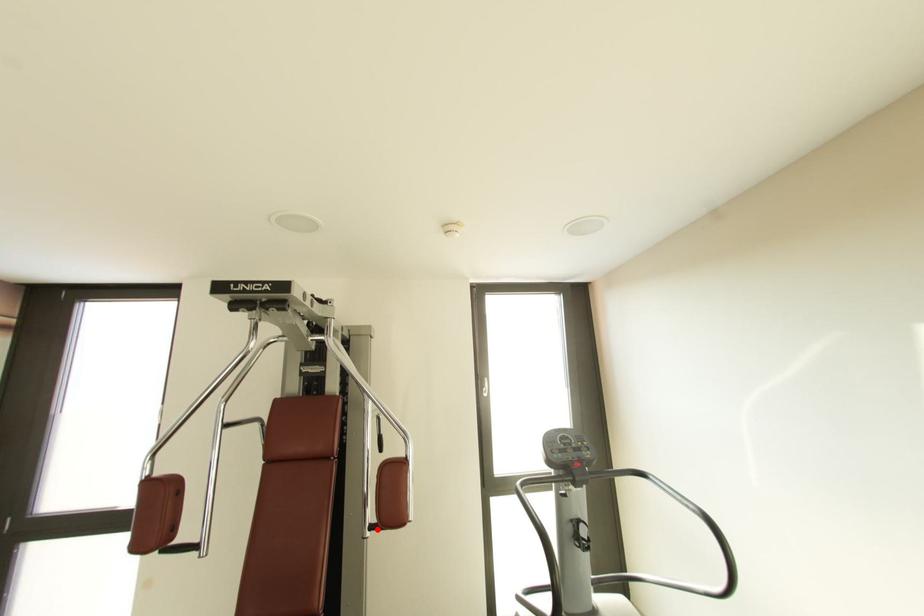
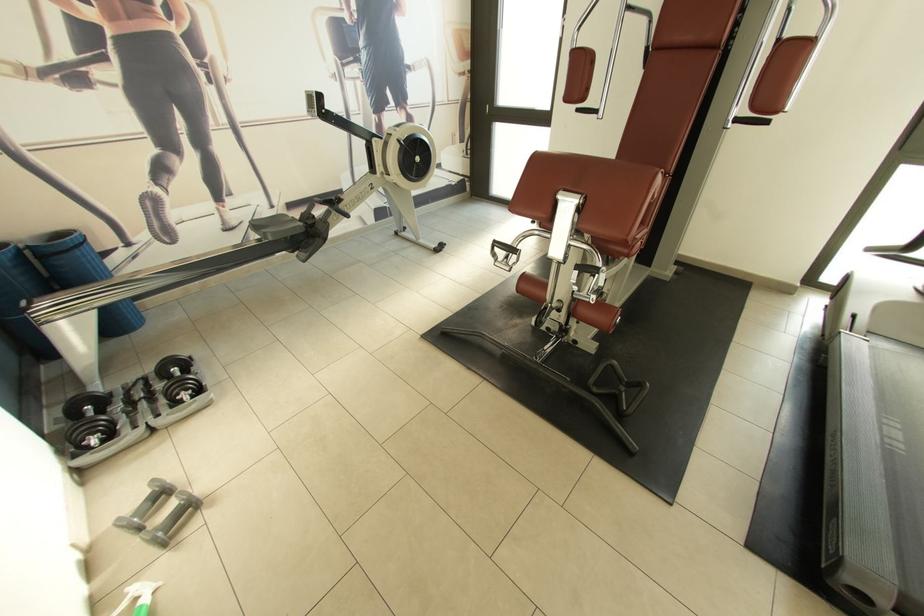
Locate, in the second image, the point that corresponds to the highlighted location in the first image.

(742, 121)